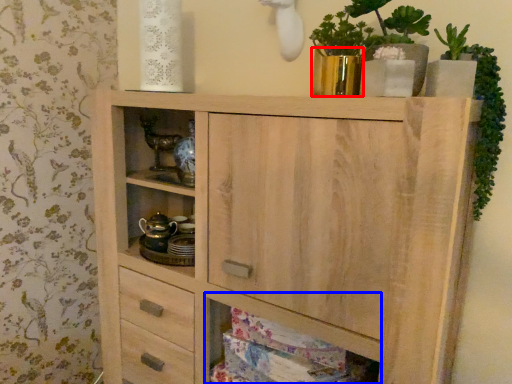
Question: Which point is closer to the camera, glass vase (highlighted by a red box) or cabinet (highlighted by a blue box)?

Choices:
 (A) glass vase
 (B) cabinet

Answer: (B)